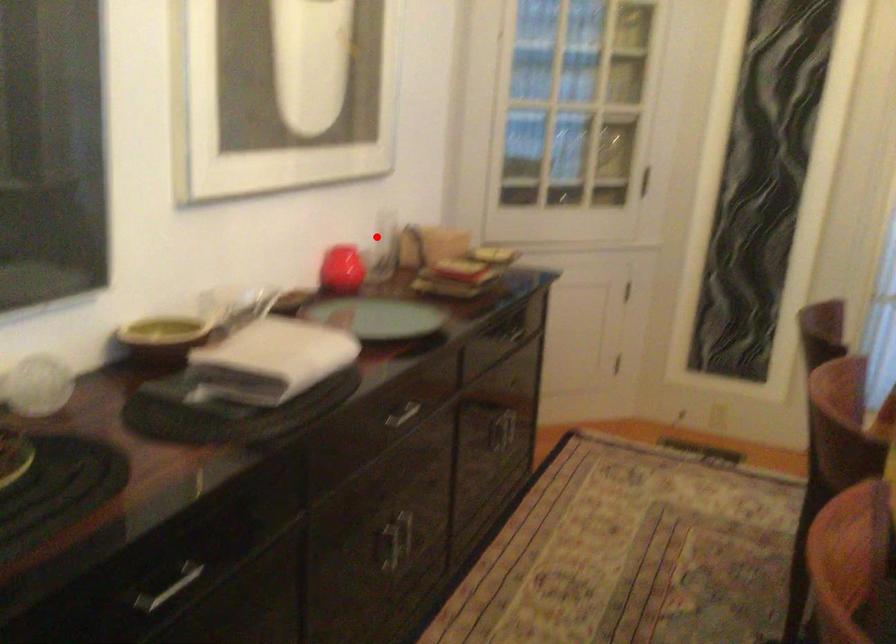
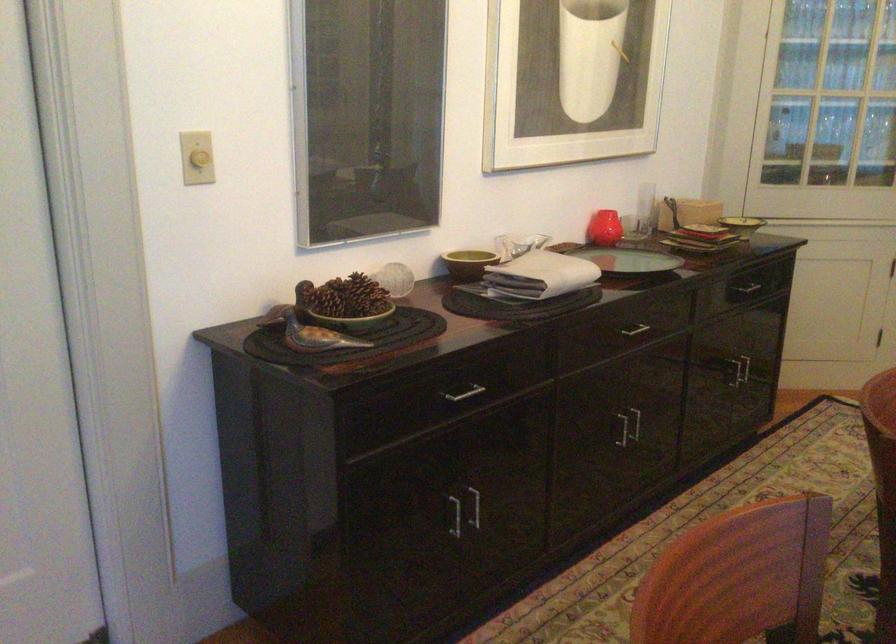
Question: I am providing you with two images of the same scene from different viewpoints. Given a red point in image1, look at the same physical point in image2. Is it:

Choices:
 (A) Closer to the viewpoint
 (B) Farther from the viewpoint

Answer: (B)